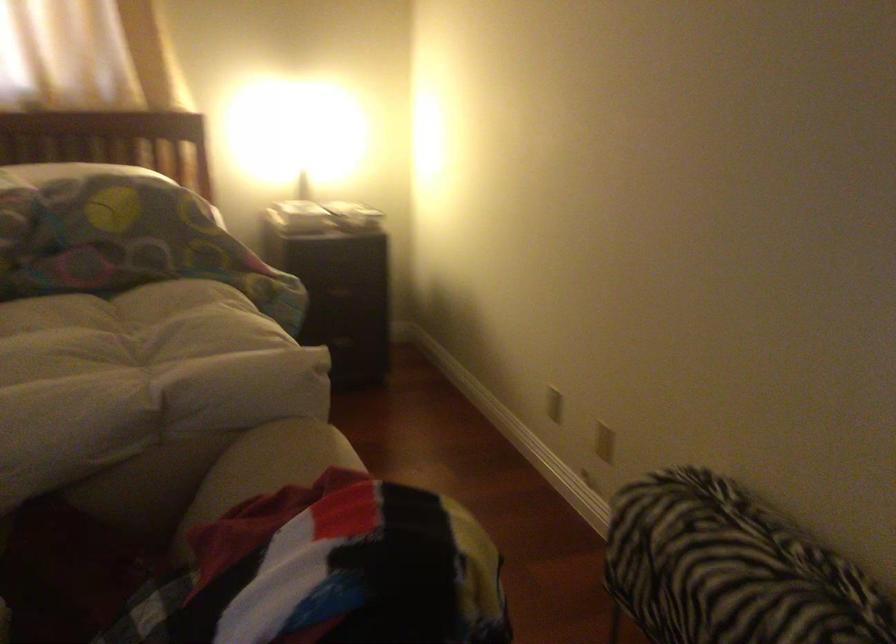
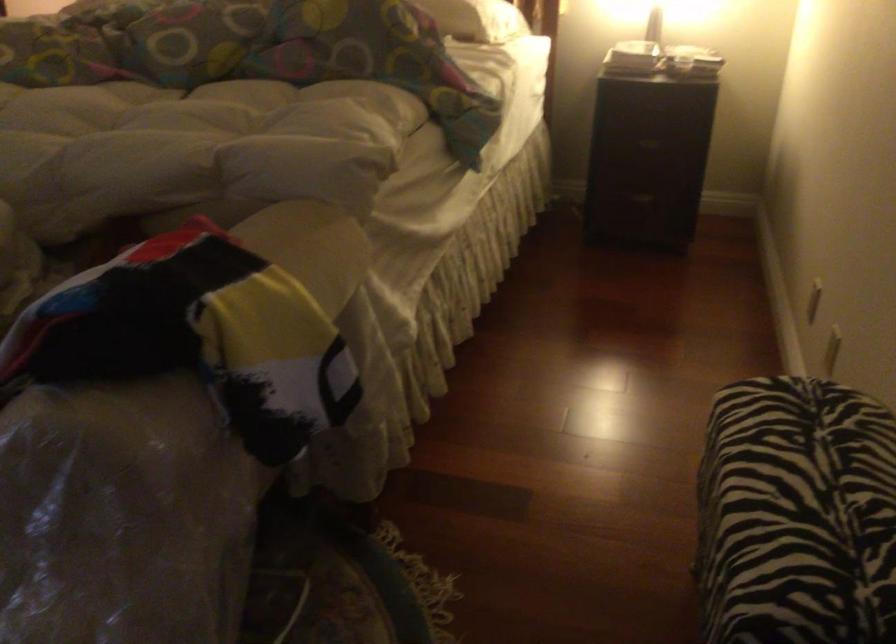
Question: How did the camera likely rotate?

Choices:
 (A) Left
 (B) Right
 (C) Up
 (D) Down

Answer: (A)